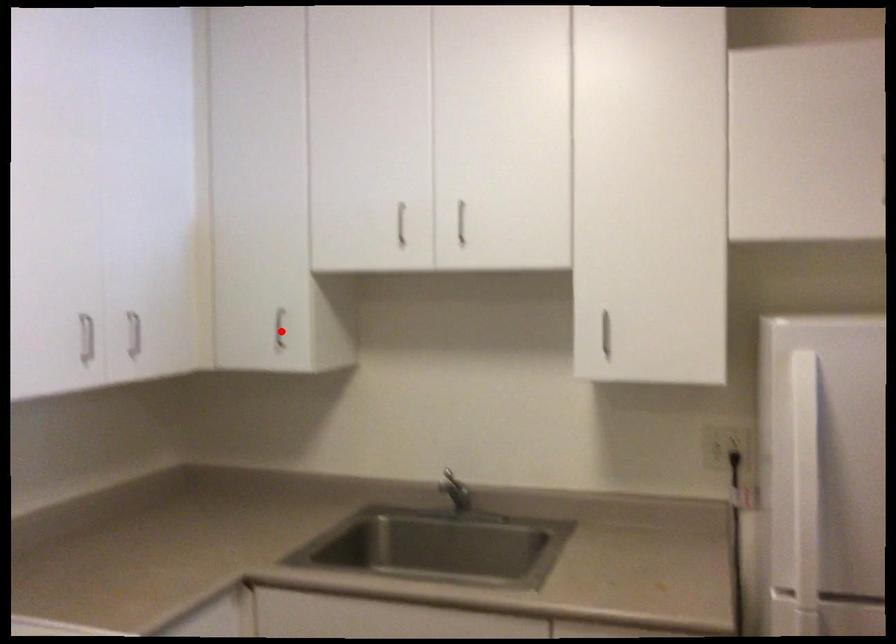
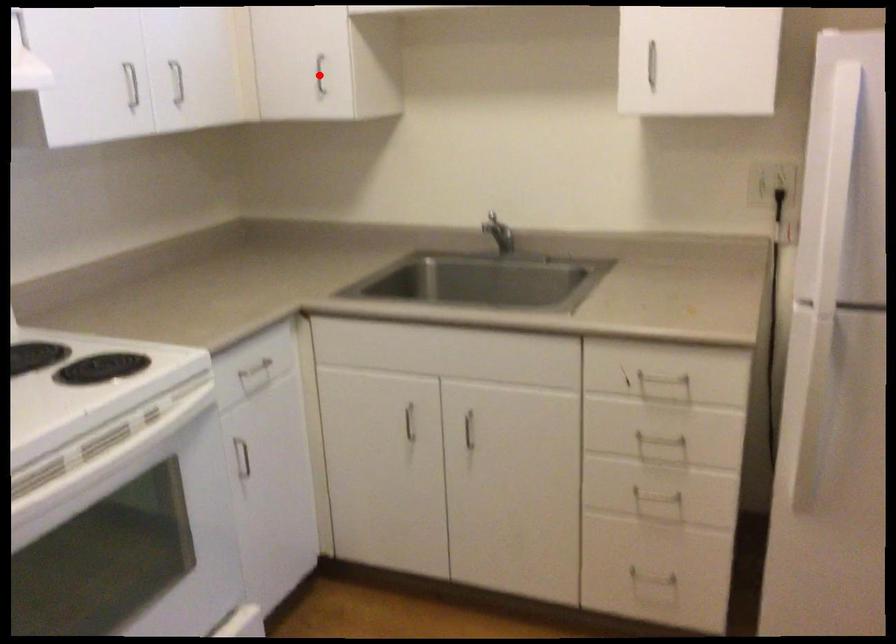
I am providing you with two images of the same scene from different viewpoints. A red point is marked on the first image and another point is marked on the second image. Are the points marked in image1 and image2 representing the same 3D position?

Yes